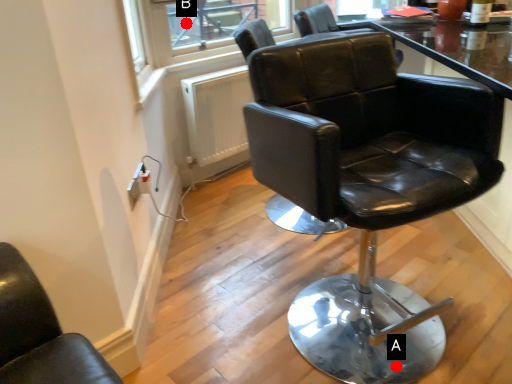
Question: Two points are circled on the image, labeled by A and B beside each circle. Which point appears closest to the camera in this image?

Choices:
 (A) A is closer
 (B) B is closer

Answer: (A)